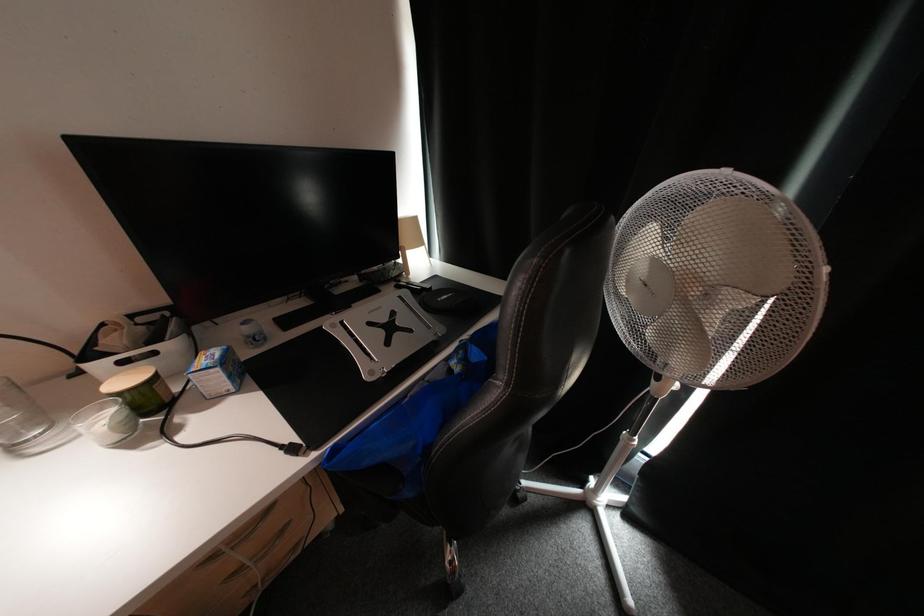
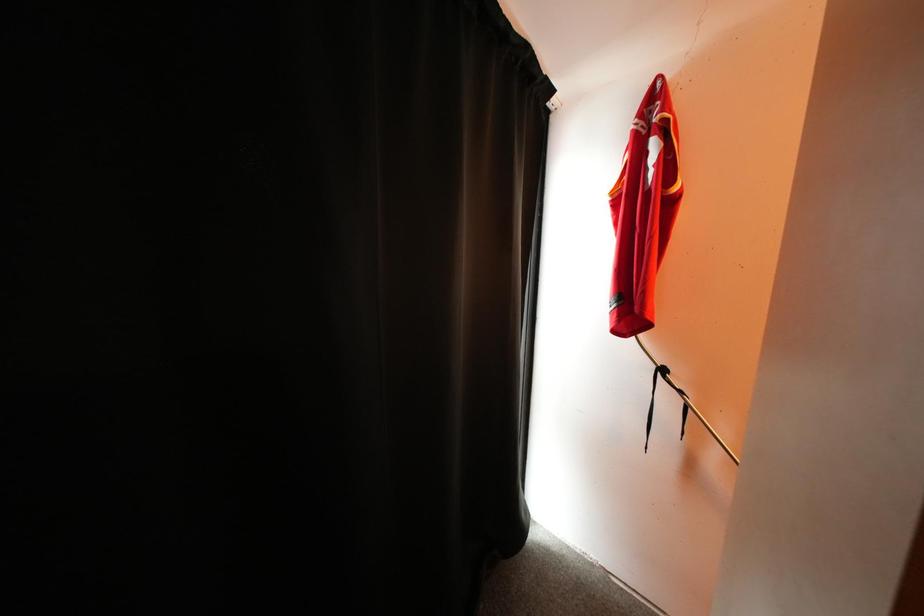
Question: The camera is either moving clockwise (left) or counter-clockwise (right) around the object. The first image is from the beginning of the video and the second image is from the end. Is the camera moving left or right when shooting the video?

Choices:
 (A) Left
 (B) Right

Answer: (A)